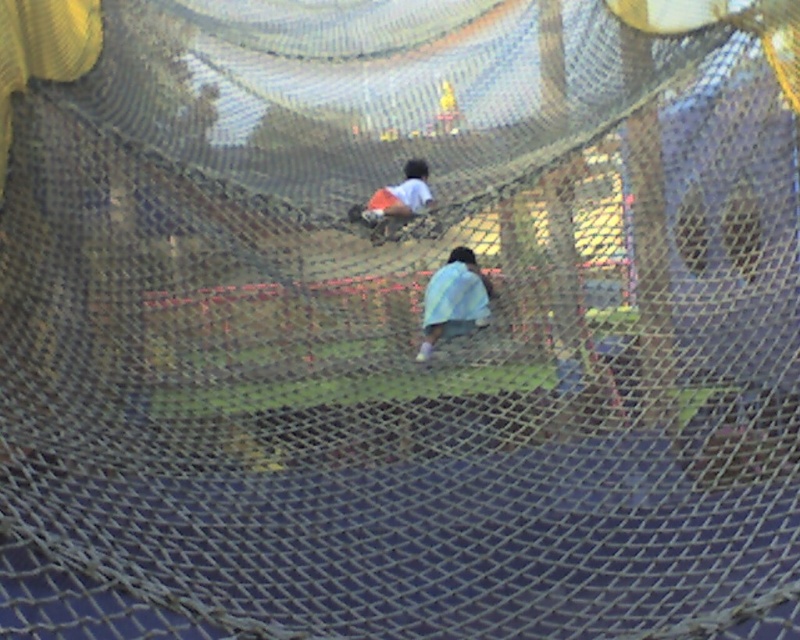
Does light blue fabric at center appear over orange shorts at center?

Actually, light blue fabric at center is below orange shorts at center.

Does light blue fabric at center appear under orange shorts at center?

Yes.

Find the location of a particular element. light blue fabric at center is located at coordinates (454, 300).